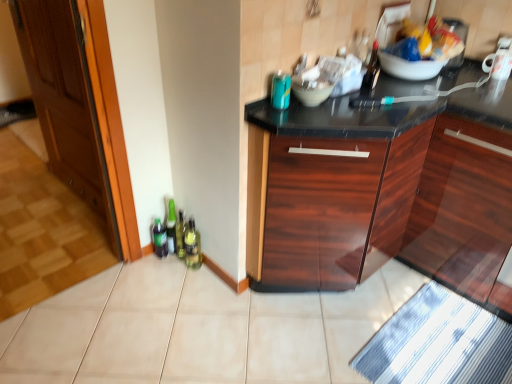
Image resolution: width=512 pixels, height=384 pixels. What are the coordinates of `vacant area that is situated to the right of matte white bowl at center` in the screenshot? It's located at (364, 110).